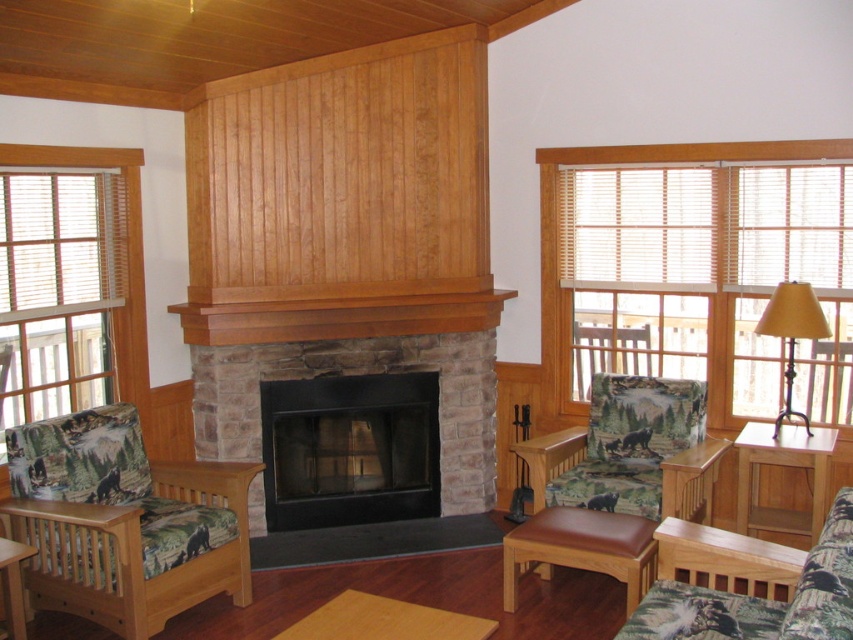
Is camouflage fabric couch at lower right to the right of metallic gold lampshade at right from the viewer's perspective?

Incorrect, camouflage fabric couch at lower right is not on the right side of metallic gold lampshade at right.

Which is behind, point (662, 573) or point (764, 317)?

Point (764, 317)

Find the location of a particular element. Image resolution: width=853 pixels, height=640 pixels. camouflage fabric couch at lower right is located at coordinates (747, 584).

The width and height of the screenshot is (853, 640). I want to click on black matte fireplace at center, so click(x=349, y=449).

Which of these two, black matte fireplace at center or light wood/texture side table at lower right, stands taller?

black matte fireplace at center is taller.

Which is in front, point (326, 483) or point (816, 499)?

Point (816, 499) is in front.

This screenshot has width=853, height=640. What are the coordinates of `black matte fireplace at center` in the screenshot? It's located at (349, 449).

Does point (122, 579) lie in front of point (604, 528)?

Yes.

Locate an element on the screen. The width and height of the screenshot is (853, 640). printed fabric armchair at left is located at coordinates (123, 522).